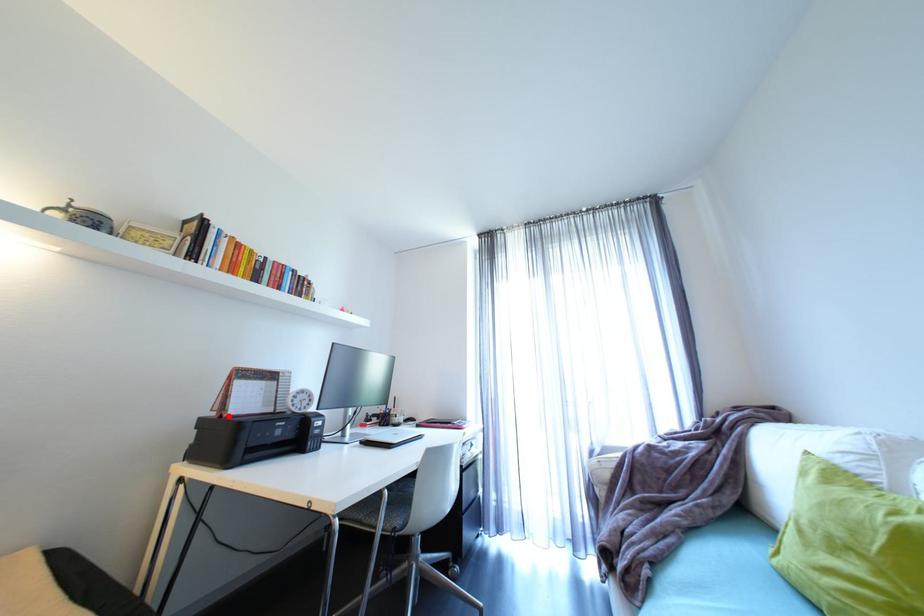
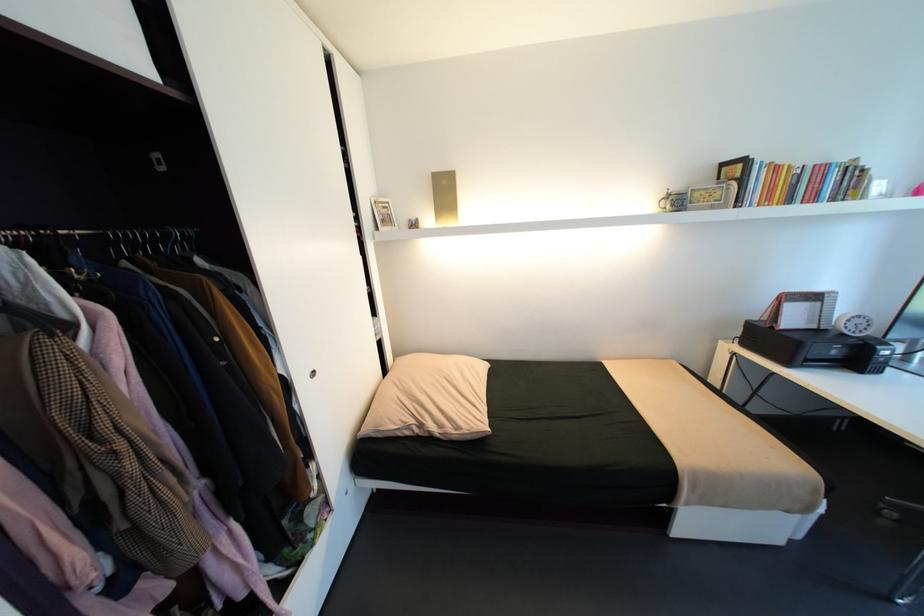
In the second image, find the point that corresponds to the highlighted location in the first image.

(779, 328)